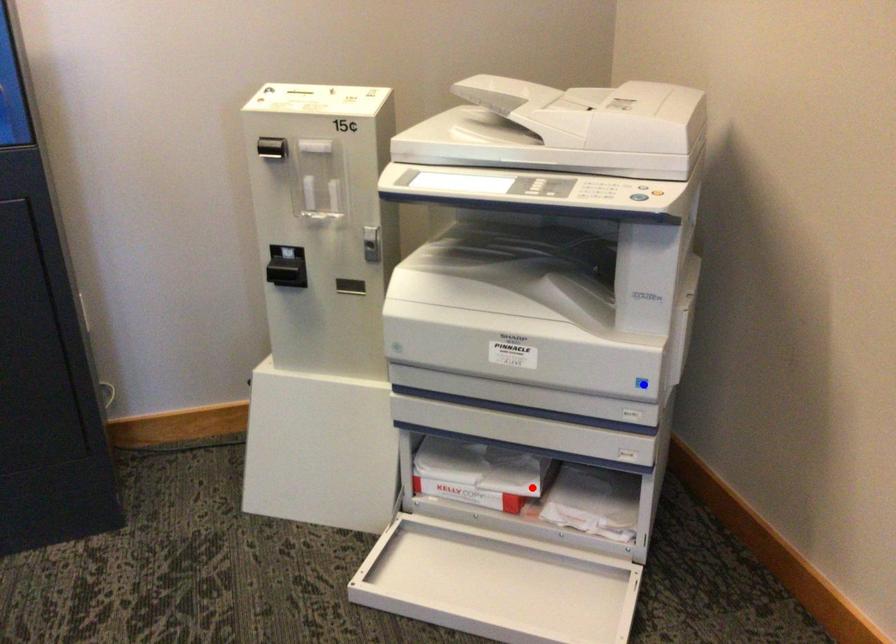
Question: Two points are marked on the image. Which point is closer to the camera?

Choices:
 (A) Blue point is closer.
 (B) Red point is closer.

Answer: (A)